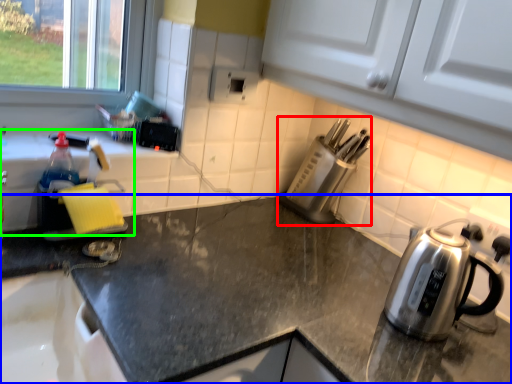
Question: Estimate the real-world distances between objects in this image. Which object is farther from appliance (highlighted by a red box), countertop (highlighted by a blue box) or sink (highlighted by a green box)?

Choices:
 (A) countertop
 (B) sink

Answer: (B)